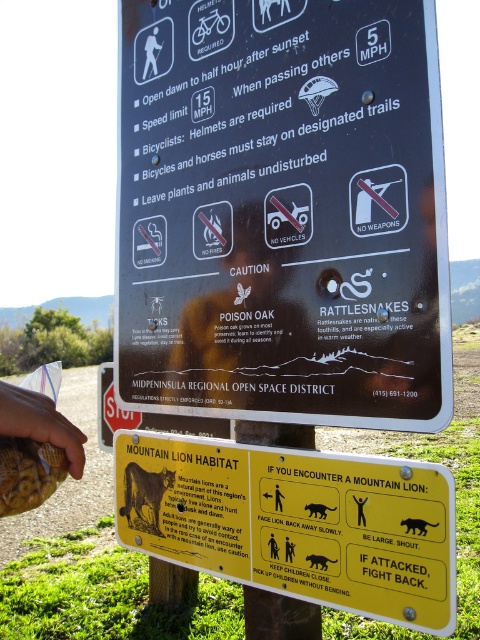
Question: Which object is the closest to the black matte cat at center?

Choices:
 (A) brown fur mountain lion at lower left
 (B) black plastic sign at upper center
 (C) brown textured bag at lower left
 (D) black matte cat at lower right

Answer: (D)

Question: Is black matte cat at lower right smaller than black fur mountain lion at lower center?

Choices:
 (A) yes
 (B) no

Answer: (A)

Question: Which object appears farthest from the camera in this image?

Choices:
 (A) yellow plastic sign at center
 (B) brown textured bag at lower left
 (C) black matte human at upper center
 (D) black fur mountain lion at lower center

Answer: (D)

Question: Does black matte cat at center have a larger size compared to black fur mountain lion at lower center?

Choices:
 (A) yes
 (B) no

Answer: (B)

Question: Among these points, which one is farthest from the camera?

Choices:
 (A) (305, 556)
 (B) (359, 515)

Answer: (A)

Question: Is yellow plastic sign at center bigger than black matte human at upper center?

Choices:
 (A) yes
 (B) no

Answer: (A)